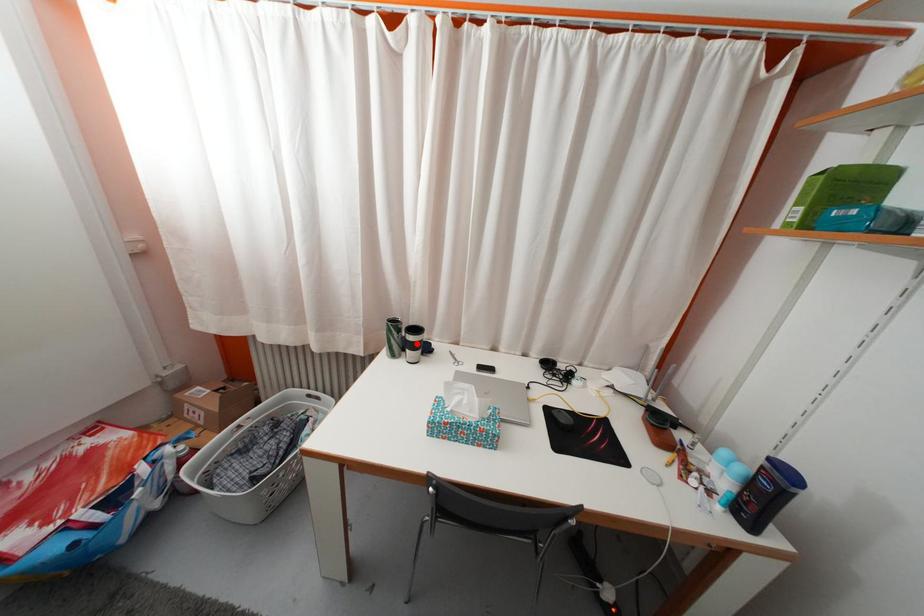
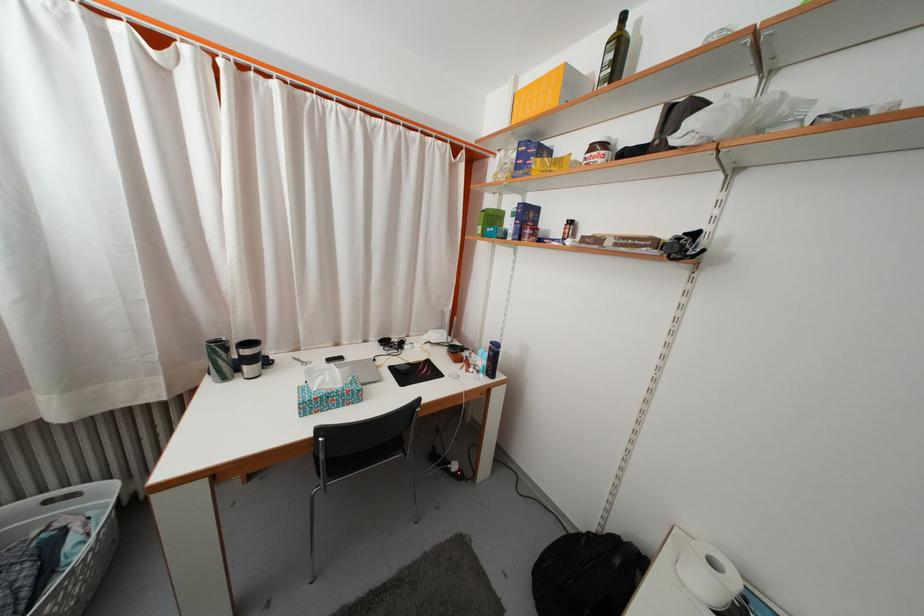
The point at the highlighted location is marked in the first image. Where is the corresponding point in the second image?

(251, 359)